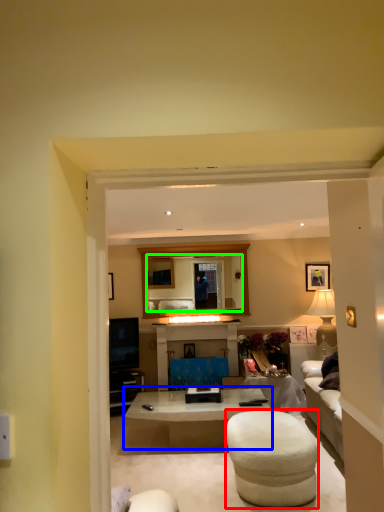
Question: Based on their relative distances, which object is farther from bar stool (highlighted by a red box)? Choose from coffee table (highlighted by a blue box) and mirror (highlighted by a green box).

Choices:
 (A) coffee table
 (B) mirror

Answer: (B)